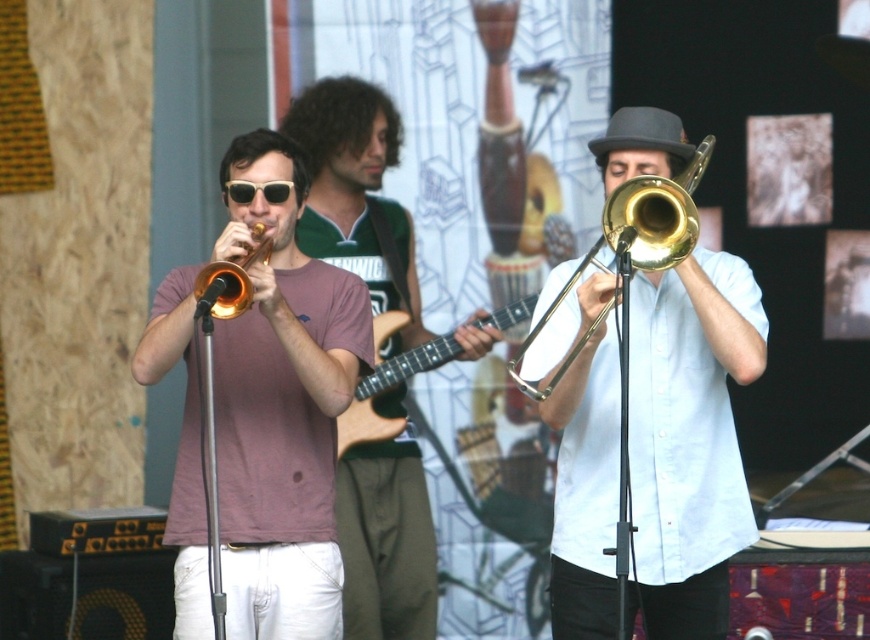
Does point (292, 474) come closer to viewer compared to point (650, 141)?

No, (292, 474) is further to viewer.

Does matte gold trumpet at center have a smaller size compared to black felt fedora at upper right?

No, matte gold trumpet at center is not smaller than black felt fedora at upper right.

Consider the image. Who is more distant from viewer, (x=288, y=636) or (x=652, y=120)?

The point (x=288, y=636) is behind.

Image resolution: width=870 pixels, height=640 pixels. Find the location of `matte gold trumpet at center`. matte gold trumpet at center is located at coordinates (282, 408).

Can you confirm if shiny gold trombone at center is taller than gold shiny trombone at center?

Yes, shiny gold trombone at center is taller than gold shiny trombone at center.

The height and width of the screenshot is (640, 870). What are the coordinates of `shiny gold trombone at center` in the screenshot? It's located at (690, 436).

Who is lower down, black felt fedora at upper right or black plastic sunglasses at center?

black plastic sunglasses at center

Can you confirm if black felt fedora at upper right is thinner than black plastic sunglasses at center?

No.

Who is more distant from viewer, (x=686, y=145) or (x=239, y=182)?

Positioned behind is point (x=239, y=182).

You are a GUI agent. You are given a task and a screenshot of the screen. Output one action in this format:
    pyautogui.click(x=<x>, y=<y>)
    Task: Click on the black felt fedora at upper right
    
    Given the screenshot: What is the action you would take?
    pyautogui.click(x=641, y=132)